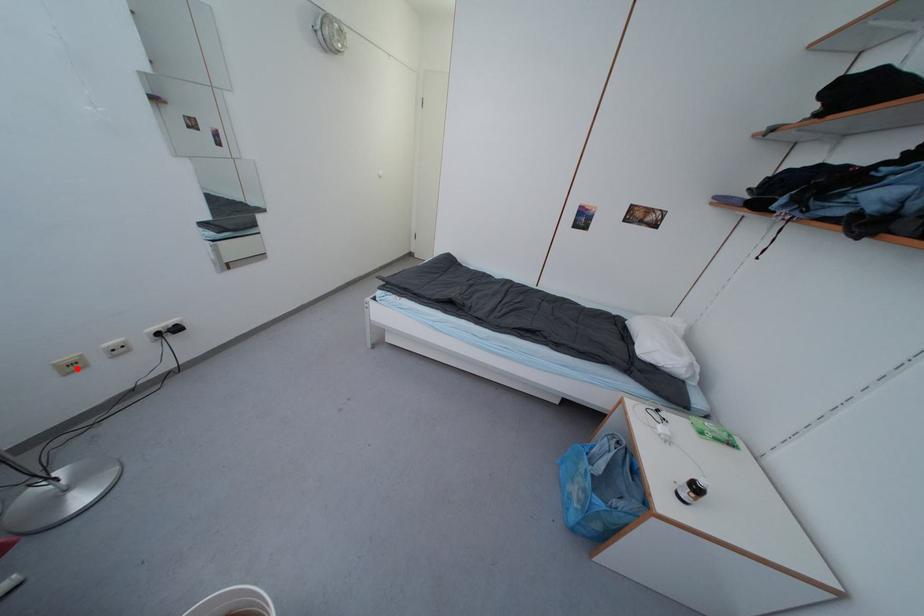
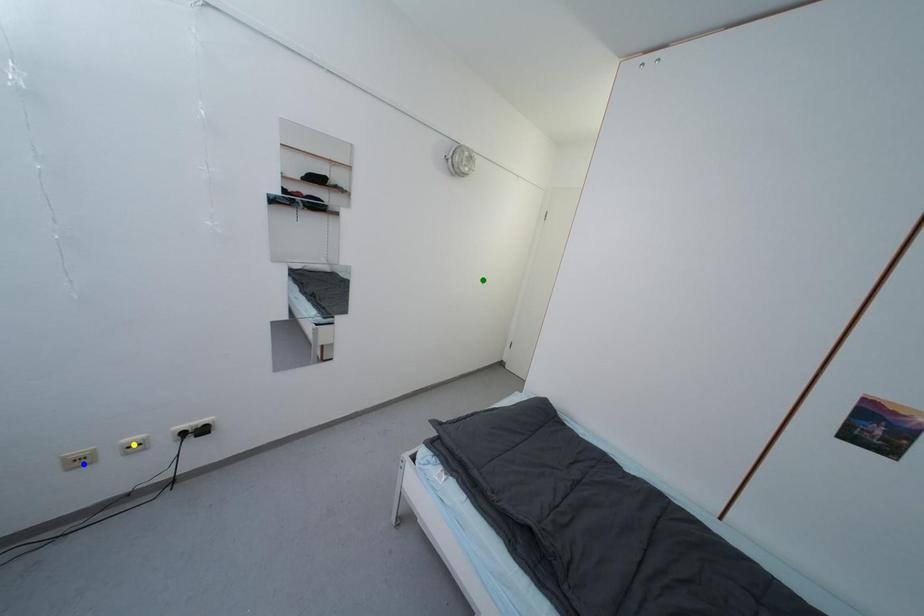
Question: I am providing you with two images of the same scene from different viewpoints. A red point is marked on the first image. You are given multiple points on the second image. Which spot in image 2 lines up with the point in image 1?

Choices:
 (A) yellow point
 (B) green point
 (C) blue point

Answer: (C)